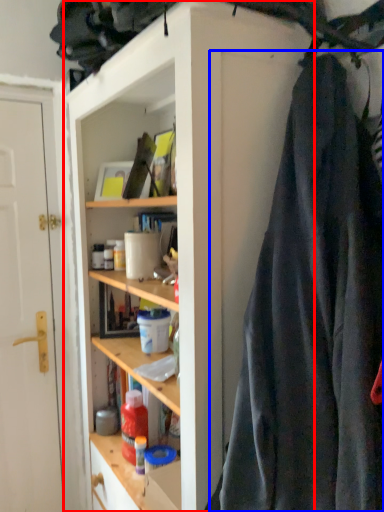
Question: Which of the following is the closest to the observer, cabinetry (highlighted by a red box) or clothing (highlighted by a blue box)?

Choices:
 (A) cabinetry
 (B) clothing

Answer: (B)